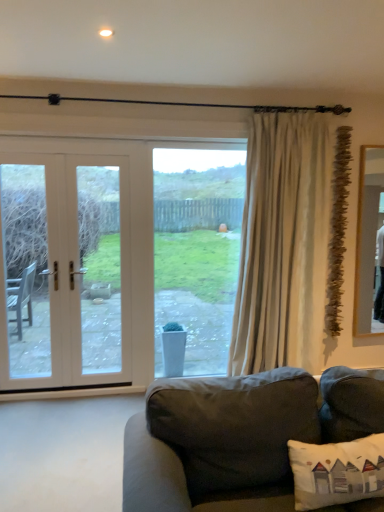
Identify the location of vacant area on top of white wood door at left (from a real-world perspective). The image size is (384, 512). (70, 141).